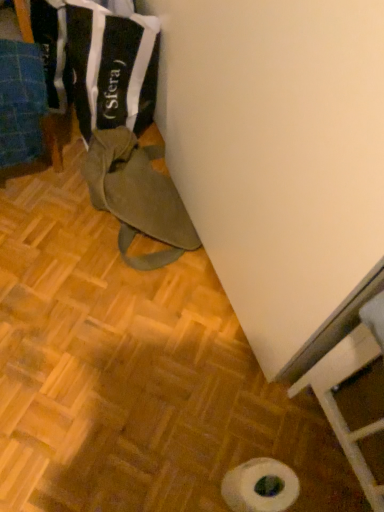
Question: Is blue fabric at left, positioned as the first wood in left-to-right order, outside white matte toilet paper at lower center?

Choices:
 (A) yes
 (B) no

Answer: (A)

Question: Considering the relative sizes of blue fabric at left, which appears as the second wood when viewed from the right, and white matte toilet paper at lower center in the image provided, is blue fabric at left, which appears as the second wood when viewed from the right, bigger than white matte toilet paper at lower center?

Choices:
 (A) no
 (B) yes

Answer: (B)

Question: Is white matte toilet paper at lower center located within blue fabric at left, which appears as the second wood when viewed from the right?

Choices:
 (A) no
 (B) yes

Answer: (A)

Question: Is blue fabric at left, which appears as the second wood when viewed from the right, wider than white matte toilet paper at lower center?

Choices:
 (A) yes
 (B) no

Answer: (A)

Question: Is blue fabric at left, which appears as the second wood when viewed from the right, touching white matte toilet paper at lower center?

Choices:
 (A) no
 (B) yes

Answer: (A)

Question: Is blue fabric at left, positioned as the first wood in left-to-right order, to the left of white matte toilet paper at lower center from the viewer's perspective?

Choices:
 (A) yes
 (B) no

Answer: (A)

Question: Is blue fabric at left, positioned as the first wood in left-to-right order, facing towards olive green canvas bag at lower left?

Choices:
 (A) no
 (B) yes

Answer: (A)

Question: Does blue fabric at left, which appears as the second wood when viewed from the right, have a greater width compared to olive green canvas bag at lower left?

Choices:
 (A) no
 (B) yes

Answer: (A)

Question: Is blue fabric at left, which appears as the second wood when viewed from the right, at the left side of olive green canvas bag at lower left?

Choices:
 (A) no
 (B) yes

Answer: (B)

Question: Is blue fabric at left, positioned as the first wood in left-to-right order, at the right side of olive green canvas bag at lower left?

Choices:
 (A) no
 (B) yes

Answer: (A)

Question: Does blue fabric at left, which appears as the second wood when viewed from the right, contain olive green canvas bag at lower left?

Choices:
 (A) yes
 (B) no

Answer: (B)

Question: Is blue fabric at left, positioned as the first wood in left-to-right order, positioned beyond the bounds of olive green canvas bag at lower left?

Choices:
 (A) yes
 (B) no

Answer: (A)

Question: Does black fabric bag at upper left appear on the right side of olive green canvas bag at lower left?

Choices:
 (A) no
 (B) yes

Answer: (A)